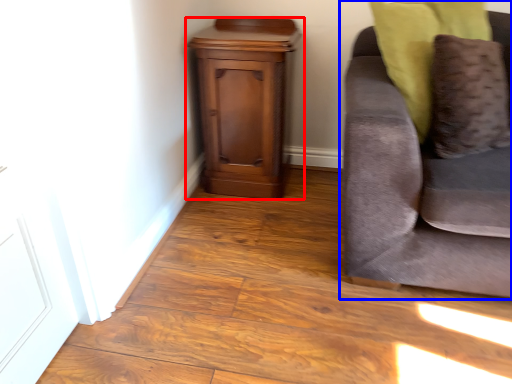
Question: Which point is closer to the camera, nightstand (highlighted by a red box) or studio couch (highlighted by a blue box)?

Choices:
 (A) nightstand
 (B) studio couch

Answer: (B)